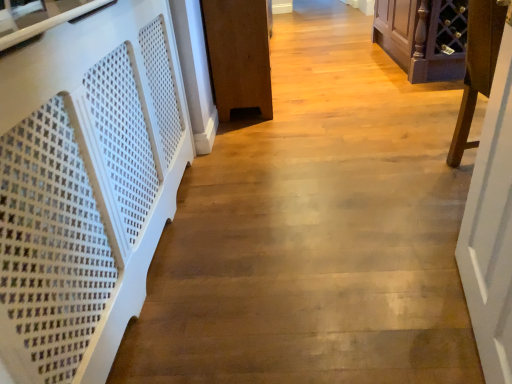
Identify the location of vacant space to the left of white wooden door at right. (355, 323).